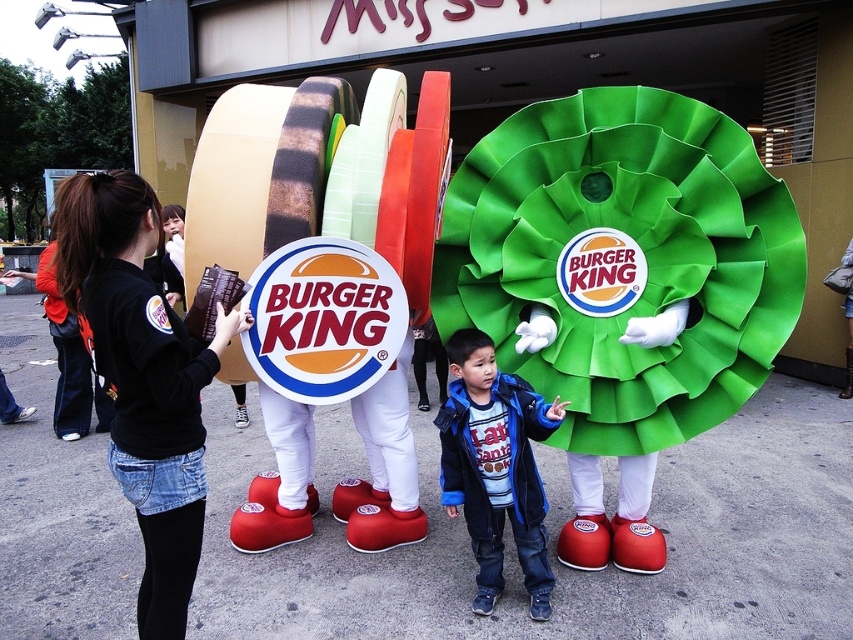
Measure the distance from black fabric jacket at left to blue fleece jacket at center.

The distance of black fabric jacket at left from blue fleece jacket at center is 4.07 feet.

Which is below, black fabric jacket at left or blue fleece jacket at center?

Positioned lower is blue fleece jacket at center.

Measure the distance between point (99, 262) and camera.

The distance of point (99, 262) from camera is 2.14 meters.

Locate an element on the screen. black fabric jacket at left is located at coordinates (143, 378).